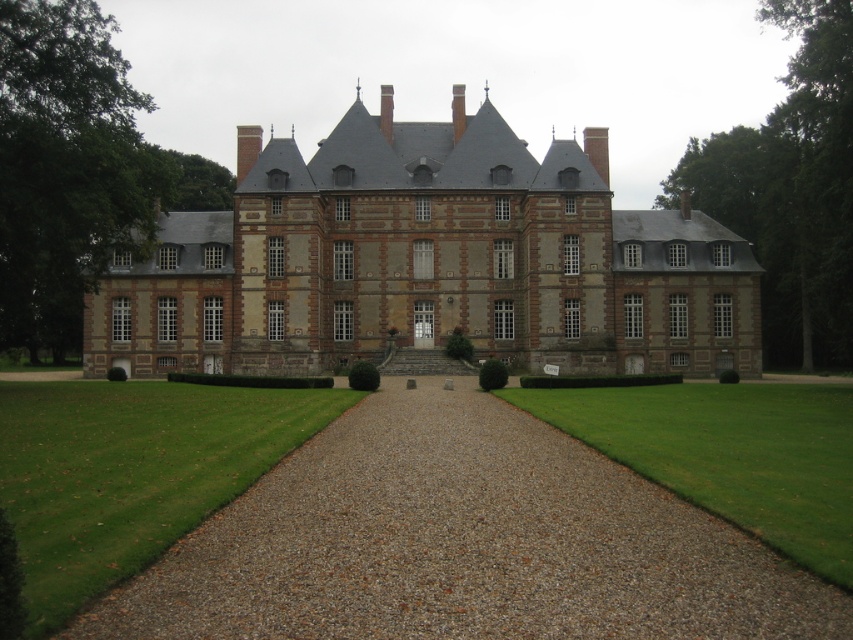
Question: In this image, where is brown brick castle at center located relative to gray gravel at center?

Choices:
 (A) above
 (B) below

Answer: (A)

Question: Is brown brick castle at center below gray gravel at center?

Choices:
 (A) no
 (B) yes

Answer: (A)

Question: Which object is closer to the camera taking this photo?

Choices:
 (A) brown brick castle at center
 (B) gray gravel at center

Answer: (B)

Question: Among these points, which one is nearest to the camera?

Choices:
 (A) (664, 216)
 (B) (366, 593)

Answer: (B)

Question: Can you confirm if brown brick castle at center is smaller than gray gravel at center?

Choices:
 (A) yes
 (B) no

Answer: (B)